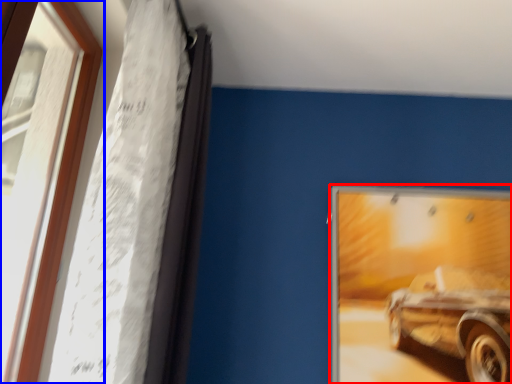
Question: Which point is further to the camera, picture frame (highlighted by a red box) or window (highlighted by a blue box)?

Choices:
 (A) picture frame
 (B) window

Answer: (A)